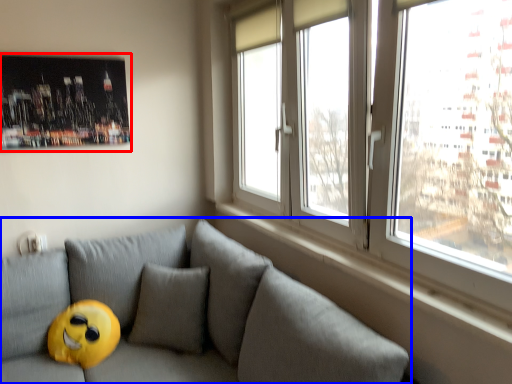
Question: Which object is further to the camera taking this photo, picture frame (highlighted by a red box) or studio couch (highlighted by a blue box)?

Choices:
 (A) picture frame
 (B) studio couch

Answer: (A)